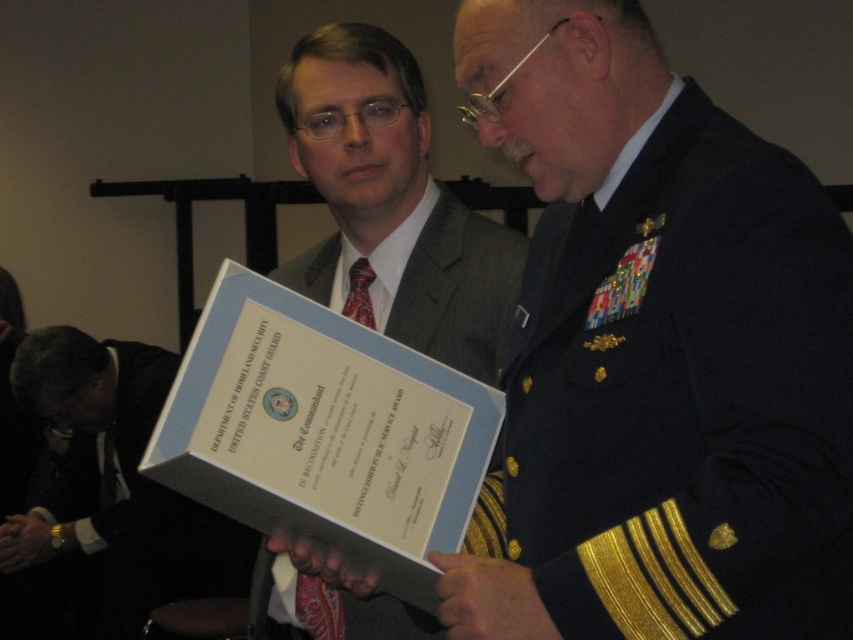
Does matte black suit at center have a lesser height compared to matte black suit at lower left?

Correct, matte black suit at center is not as tall as matte black suit at lower left.

Which of these two, matte black suit at center or matte black suit at lower left, stands shorter?

With less height is matte black suit at center.

Is point (694, 312) more distant than point (73, 497)?

That is False.

Locate an element on the screen. matte black suit at center is located at coordinates (657, 353).

Does matte black suit at center have a greater height compared to matte gray suit at center?

Correct, matte black suit at center is much taller as matte gray suit at center.

Is matte black suit at center thinner than matte gray suit at center?

No, matte black suit at center is not thinner than matte gray suit at center.

This screenshot has height=640, width=853. Identify the location of matte black suit at center. (657, 353).

Locate an element on the screen. matte gray suit at center is located at coordinates (392, 205).

Describe the element at coordinates (392, 205) in the screenshot. I see `matte gray suit at center` at that location.

Does point (354, 173) come in front of point (144, 593)?

Yes, it is in front of point (144, 593).

Locate an element on the screen. matte gray suit at center is located at coordinates (392, 205).